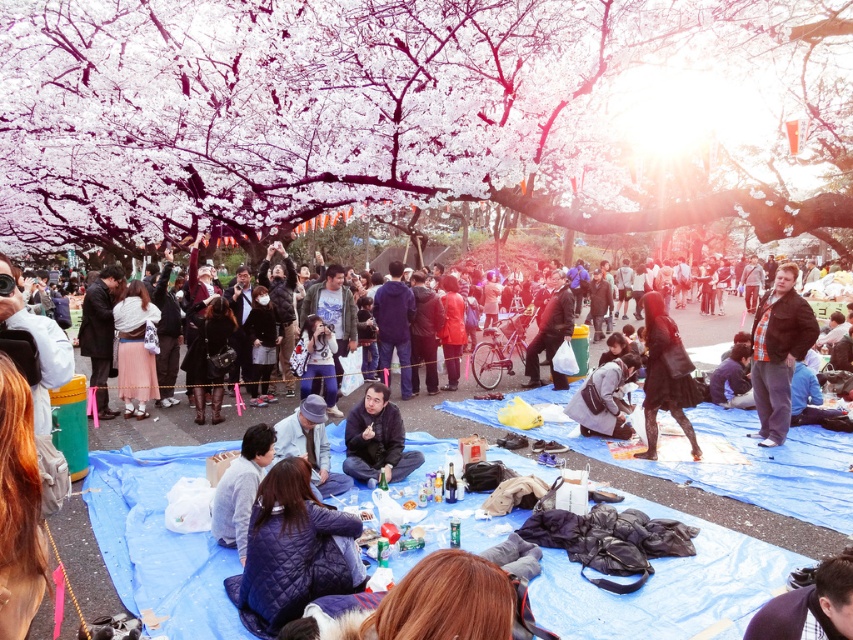
You are organizing a picnic under the cherry blossom trees and need to place a 20 feet long picnic blanket between the quilted blue jacket at center and the dark brown leather jacket at center. Can you fit the blanket between them?

The quilted blue jacket at center and dark brown leather jacket at center are 21.93 feet apart, so yes, the 20 feet long picnic blanket can fit between them since the distance between them is greater than the blanket length.

You are planning to set up a picnic under the white blossoming tree at center. Considering the dark blue fabric at center is already there, will the tree provide enough shade to cover the entire fabric? Please explain based on their sizes.

The white blossoming tree at center has a larger width than the dark blue fabric at center. Therefore, the tree should provide sufficient shade to cover the entire fabric.